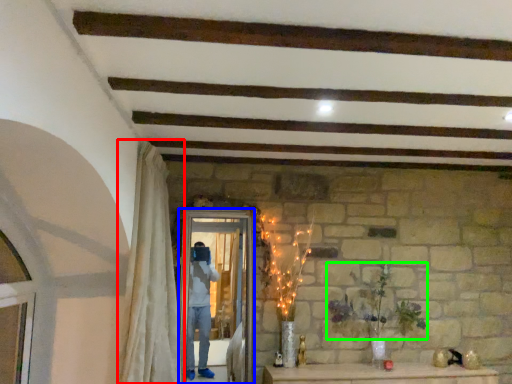
Question: Which object is positioned closest to curtain (highlighted by a red box)? Select from screen door (highlighted by a blue box) and plant (highlighted by a green box).

Choices:
 (A) screen door
 (B) plant

Answer: (A)